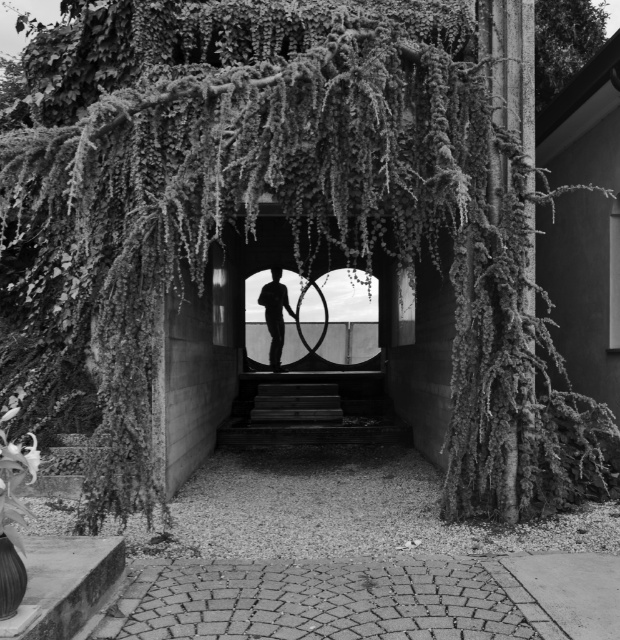
Does point (350, 381) lie in front of point (283, 333)?

Yes, it is in front of point (283, 333).

Does smooth glass door at center have a lesser height compared to silhouette figure at center?

In fact, smooth glass door at center may be taller than silhouette figure at center.

Which is in front, point (285, 275) or point (275, 276)?

Point (275, 276) is in front.

Find the location of a particular element. smooth glass door at center is located at coordinates (312, 388).

Can you confirm if smooth glass door at center is positioned to the left of smooth wooden stairs at center?

Correct, you'll find smooth glass door at center to the left of smooth wooden stairs at center.

Which is below, smooth glass door at center or smooth wooden stairs at center?

smooth wooden stairs at center is lower down.

Describe the element at coordinates (312, 388) in the screenshot. I see `smooth glass door at center` at that location.

At what (x,y) coordinates should I click in order to perform the action: click on smooth glass door at center. Please return your answer as a coordinate pair (x, y). The height and width of the screenshot is (640, 620). Looking at the image, I should click on (312, 388).

Is point (254, 436) in front of point (572, 67)?

No, (254, 436) is further to viewer.

Does smooth glass door at center lie behind green leafy tree at upper right?

Yes, it is behind green leafy tree at upper right.

Is point (285, 332) positioned behind point (558, 17)?

Yes, point (285, 332) is behind point (558, 17).

You are a GUI agent. You are given a task and a screenshot of the screen. Output one action in this format:
    pyautogui.click(x=<x>, y=<y>)
    Task: Click on the smooth glass door at center
    The height and width of the screenshot is (640, 620).
    Given the screenshot: What is the action you would take?
    pyautogui.click(x=312, y=388)